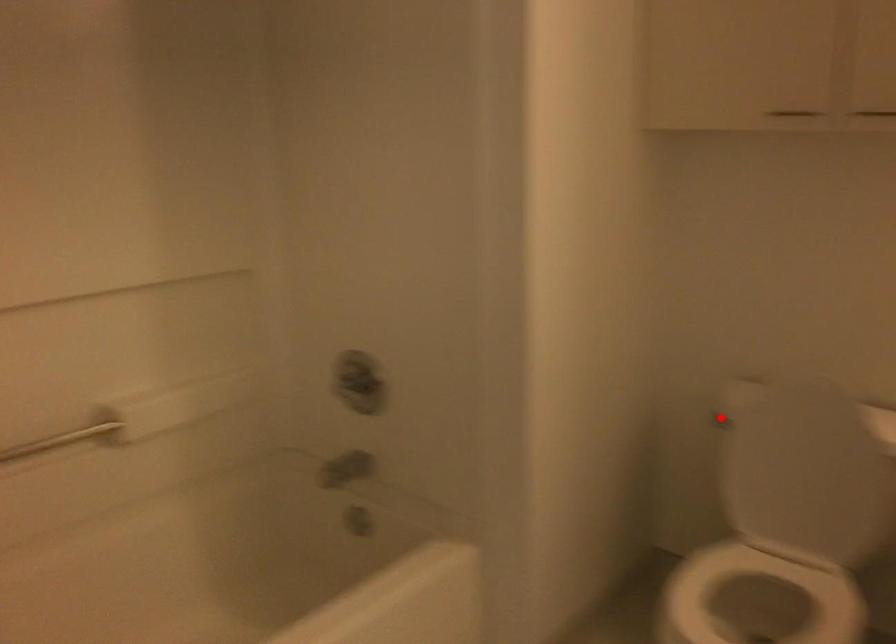
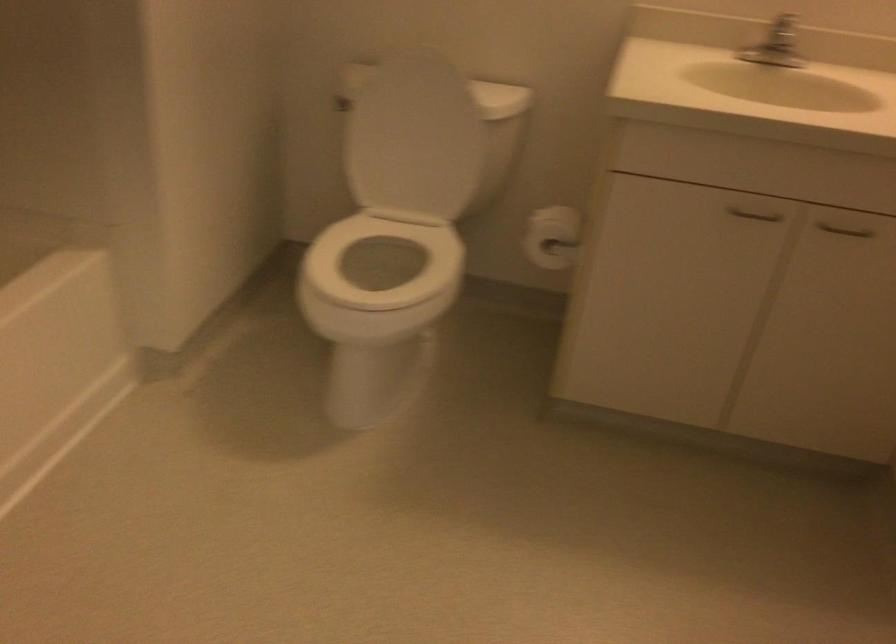
Question: I am providing you with two images of the same scene from different viewpoints. Given a red point in image1, look at the same physical point in image2. Is it:

Choices:
 (A) Closer to the viewpoint
 (B) Farther from the viewpoint

Answer: (B)